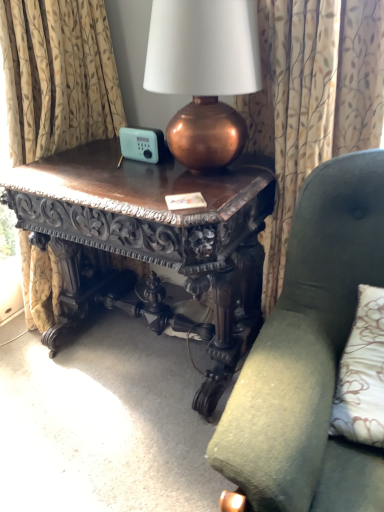
Locate an element on the screen. Image resolution: width=384 pixels, height=512 pixels. free space above polished dark wood table at center (from a real-world perspective) is located at coordinates pos(140,168).